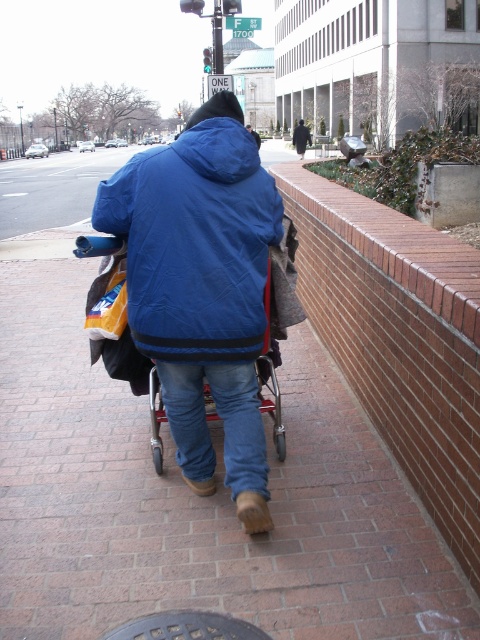
You are a delivery robot on the sidewalk and need to deliver a package to the person wearing the blue fleece jacket at center. The dark gray metallic manhole cover at lower center is in your path. Can you go around it to reach the person?

The dark gray metallic manhole cover at lower center is closer to the viewer than the blue fleece jacket at center, so you can go around it to reach the person wearing the blue fleece jacket at center.

You are a fashion designer observing a person wearing two jackets. The person has a matte blue jacket at center and a blue fleece jacket at center. Which one is positioned to the left?

The matte blue jacket at center is to the left of the blue fleece jacket at center.